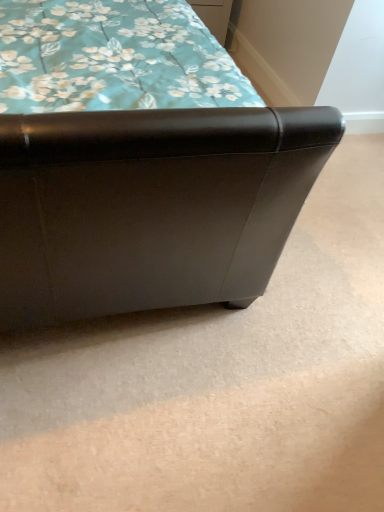
Question: Is matte wood drawer at upper center bigger or smaller than matte black ottoman at lower left?

Choices:
 (A) big
 (B) small

Answer: (B)

Question: From the image's perspective, is matte wood drawer at upper center located above or below matte black ottoman at lower left?

Choices:
 (A) above
 (B) below

Answer: (A)

Question: Is matte wood drawer at upper center inside the boundaries of matte black ottoman at lower left, or outside?

Choices:
 (A) outside
 (B) inside

Answer: (A)

Question: Would you say matte black ottoman at lower left is to the left or to the right of matte wood drawer at upper center in the picture?

Choices:
 (A) left
 (B) right

Answer: (A)

Question: Is matte black ottoman at lower left situated inside matte wood drawer at upper center or outside?

Choices:
 (A) inside
 (B) outside

Answer: (B)

Question: Considering their positions, is matte black ottoman at lower left located in front of or behind matte wood drawer at upper center?

Choices:
 (A) behind
 (B) front

Answer: (B)

Question: Is matte black ottoman at lower left bigger or smaller than matte wood drawer at upper center?

Choices:
 (A) small
 (B) big

Answer: (B)